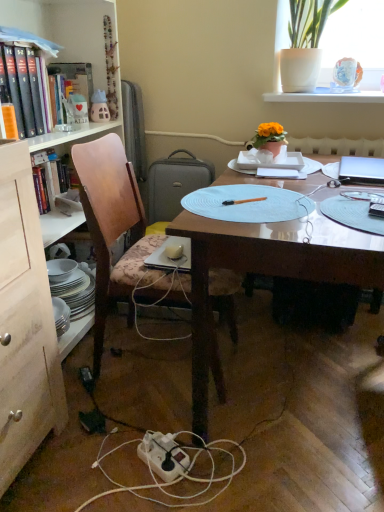
In order to click on vacant space that is in between clear plastic pen at center and light blue paper plate at center in this screenshot , I will do `click(336, 208)`.